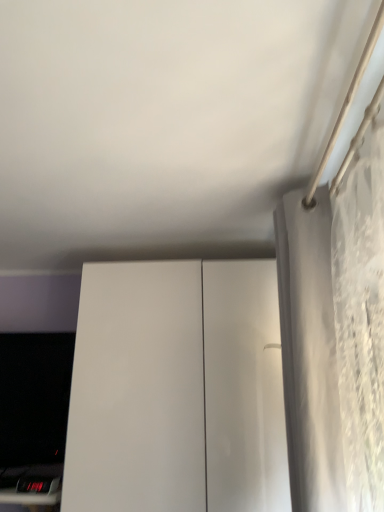
Describe the element at coordinates (34, 397) in the screenshot. I see `black glossy computer monitor at lower left` at that location.

In order to face white textured curtain at right, should I rotate leftwards or rightwards?

To face it directly, rotate right by 14.781 degrees.

Locate an element on the screen. Image resolution: width=384 pixels, height=512 pixels. white glossy cabinet at center is located at coordinates (177, 390).

Does white textured curtain at right have a smaller size compared to black glossy computer monitor at lower left?

Incorrect, white textured curtain at right is not smaller in size than black glossy computer monitor at lower left.

Considering the sizes of white textured curtain at right and black glossy computer monitor at lower left in the image, is white textured curtain at right taller or shorter than black glossy computer monitor at lower left?

Considering their sizes, white textured curtain at right has more height than black glossy computer monitor at lower left.

Find the location of `computer monitor below the white textured curtain at right (from a real-world perspective)`. computer monitor below the white textured curtain at right (from a real-world perspective) is located at coordinates (34, 397).

How far apart are white textured curtain at right and black glossy computer monitor at lower left?

A distance of 1.07 meters exists between white textured curtain at right and black glossy computer monitor at lower left.

From a real-world perspective, is white textured curtain at right physically below white glossy cabinet at center?

No, from a real-world perspective, white textured curtain at right is not under white glossy cabinet at center.

Is white textured curtain at right to the right of white glossy cabinet at center from the viewer's perspective?

Correct, you'll find white textured curtain at right to the right of white glossy cabinet at center.

Considering the positions of objects white textured curtain at right and white glossy cabinet at center in the image provided, who is in front, white textured curtain at right or white glossy cabinet at center?

white textured curtain at right.

Is black glossy computer monitor at lower left located outside white textured curtain at right?

black glossy computer monitor at lower left is positioned outside white textured curtain at right.

From a real-world perspective, between black glossy computer monitor at lower left and white textured curtain at right, who is vertically lower?

black glossy computer monitor at lower left.

How many degrees apart are the facing directions of black glossy computer monitor at lower left and white textured curtain at right?

The angle between the facing direction of black glossy computer monitor at lower left and the facing direction of white textured curtain at right is 90 degrees.

Is point (181, 324) farther from camera compared to point (21, 464)?

No, (181, 324) is in front of (21, 464).

From the picture: Is white glossy cabinet at center positioned beyond the bounds of black glossy computer monitor at lower left?

Yes.

Can you confirm if white glossy cabinet at center is taller than black glossy computer monitor at lower left?

Correct, white glossy cabinet at center is much taller as black glossy computer monitor at lower left.

Is white glossy cabinet at center with black glossy computer monitor at lower left?

No, white glossy cabinet at center is not making contact with black glossy computer monitor at lower left.

Is white glossy cabinet at center bigger than white textured curtain at right?

Indeed, white glossy cabinet at center has a larger size compared to white textured curtain at right.

Is white glossy cabinet at center inside or outside of white textured curtain at right?

white glossy cabinet at center is not enclosed by white textured curtain at right.

From the image's perspective, which one is positioned higher, white glossy cabinet at center or white textured curtain at right?

From the image's view, white textured curtain at right is above.

Can you confirm if black glossy computer monitor at lower left is shorter than white glossy cabinet at center?

Yes, black glossy computer monitor at lower left is shorter than white glossy cabinet at center.

How different are the orientations of black glossy computer monitor at lower left and white glossy cabinet at center in degrees?

0.00111 degrees separate the facing orientations of black glossy computer monitor at lower left and white glossy cabinet at center.

Can white glossy cabinet at center be found inside black glossy computer monitor at lower left?

Definitely not — white glossy cabinet at center is not inside black glossy computer monitor at lower left.

Between point (45, 386) and point (181, 464), which one is positioned behind?

The point (45, 386) is farther from the camera.

You are a GUI agent. You are given a task and a screenshot of the screen. Output one action in this format:
    pyautogui.click(x=<x>, y=<y>)
    Task: Click on the computer monitor to the left of white textured curtain at right
    
    Given the screenshot: What is the action you would take?
    pyautogui.click(x=34, y=397)

Find the location of a particular element. The height and width of the screenshot is (512, 384). dresser below the white textured curtain at right (from the image's perspective) is located at coordinates (177, 390).

When comparing their distances from black glossy computer monitor at lower left, does white glossy cabinet at center or white textured curtain at right seem closer?

Based on the image, white glossy cabinet at center appears to be nearer to black glossy computer monitor at lower left.

Based on their spatial positions, is white textured curtain at right or white glossy cabinet at center further from black glossy computer monitor at lower left?

Based on the image, white textured curtain at right appears to be further to black glossy computer monitor at lower left.

Based on the photo, which object lies further to the anchor point white glossy cabinet at center, white textured curtain at right or black glossy computer monitor at lower left?

white textured curtain at right is positioned further to the anchor white glossy cabinet at center.

Looking at the image, which one is located closer to white textured curtain at right, white glossy cabinet at center or black glossy computer monitor at lower left?

white glossy cabinet at center.

Based on their spatial positions, is black glossy computer monitor at lower left or white glossy cabinet at center closer to white textured curtain at right?

white glossy cabinet at center is closer to white textured curtain at right.

Considering their positions, is black glossy computer monitor at lower left positioned further to white glossy cabinet at center than white textured curtain at right?

Among the two, white textured curtain at right is located further to white glossy cabinet at center.

Find the location of a particular element. The width and height of the screenshot is (384, 512). dresser between black glossy computer monitor at lower left and white textured curtain at right is located at coordinates (177, 390).